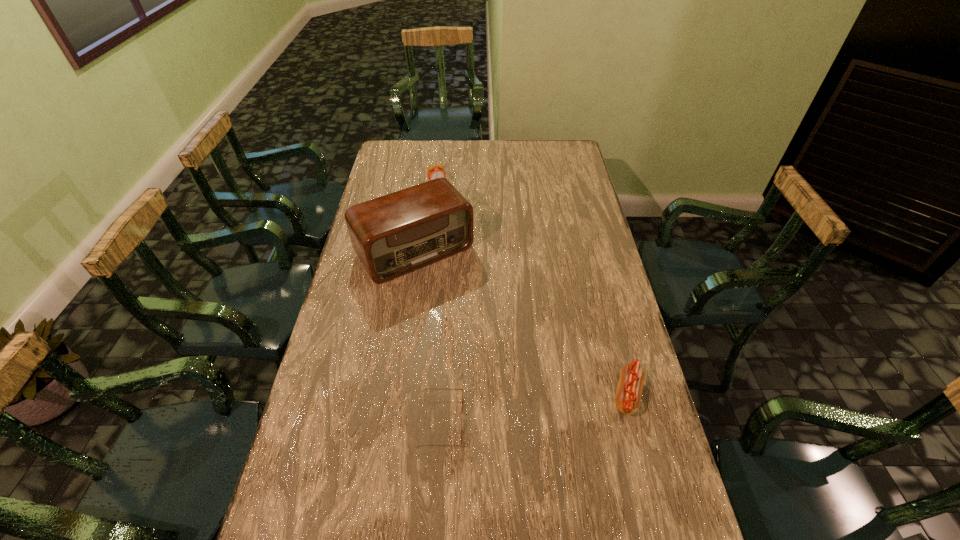
Find the location of a particular element. the shortest object is located at coordinates (428, 388).

This screenshot has height=540, width=960. Identify the location of the third tallest object. (628, 395).

Image resolution: width=960 pixels, height=540 pixels. I want to click on sausage, so click(x=628, y=395).

Image resolution: width=960 pixels, height=540 pixels. Find the location of `the tallest object`. the tallest object is located at coordinates (400, 232).

The width and height of the screenshot is (960, 540). Identify the location of radio receiver. (400, 232).

In order to click on the farthest object in this screenshot , I will do `click(434, 172)`.

Locate an element on the screen. The height and width of the screenshot is (540, 960). the second tallest object is located at coordinates (434, 172).

Identify the location of free space located 0.090m on the face of the sunglasses. (496, 421).

I want to click on vacant position located on the left of the rightmost object, so click(x=477, y=395).

The width and height of the screenshot is (960, 540). What are the coordinates of `free space located on the front panel of the tallest object` in the screenshot? It's located at (451, 293).